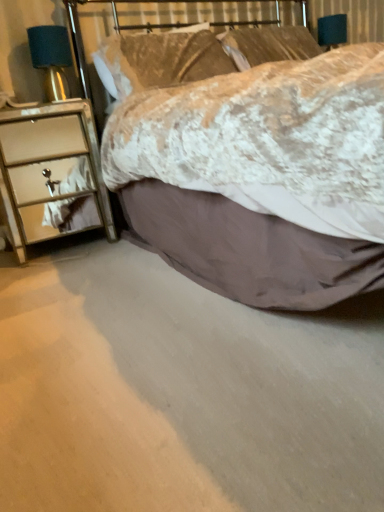
Question: Looking at their shapes, would you say linen pillow at upper center, the second pillow positioned from the left, is wider or thinner than metallic mirrored chest of drawers at left?

Choices:
 (A) wide
 (B) thin

Answer: (B)

Question: From the image's perspective, is linen pillow at upper center, the second pillow positioned from the left, above or below metallic mirrored chest of drawers at left?

Choices:
 (A) below
 (B) above

Answer: (B)

Question: Which object is the closest to the linen pillow at upper center, the second pillow positioned from the left?

Choices:
 (A) satin teal lampshade at left
 (B) metallic mirrored chest of drawers at left
 (C) linen pillow at upper center, the first pillow from the left
 (D) velvet-like beige bed at center

Answer: (C)

Question: Which of these objects is positioned closest to the linen pillow at upper center, the 2th pillow in the right-to-left sequence?

Choices:
 (A) velvet-like beige bed at center
 (B) satin teal lampshade at left
 (C) linen pillow at upper center, which appears as the first pillow when viewed from the right
 (D) metallic mirrored chest of drawers at left

Answer: (C)